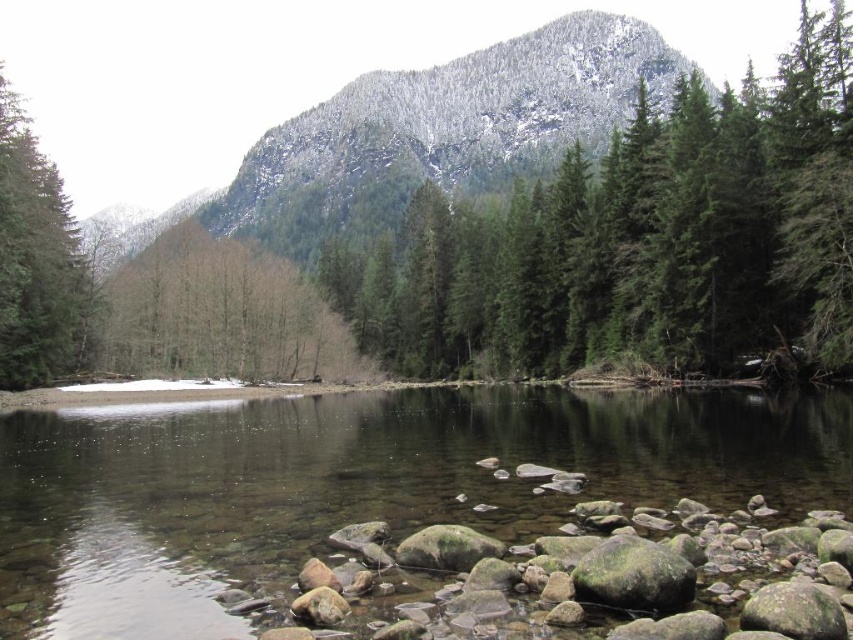
You are a hiker trying to cross the river. You see the clear smooth water at center and the green matte tree at left. Which object is lower in the scene?

The clear smooth water at center is below the green matte tree at left, so the clear smooth water at center is lower in the scene.